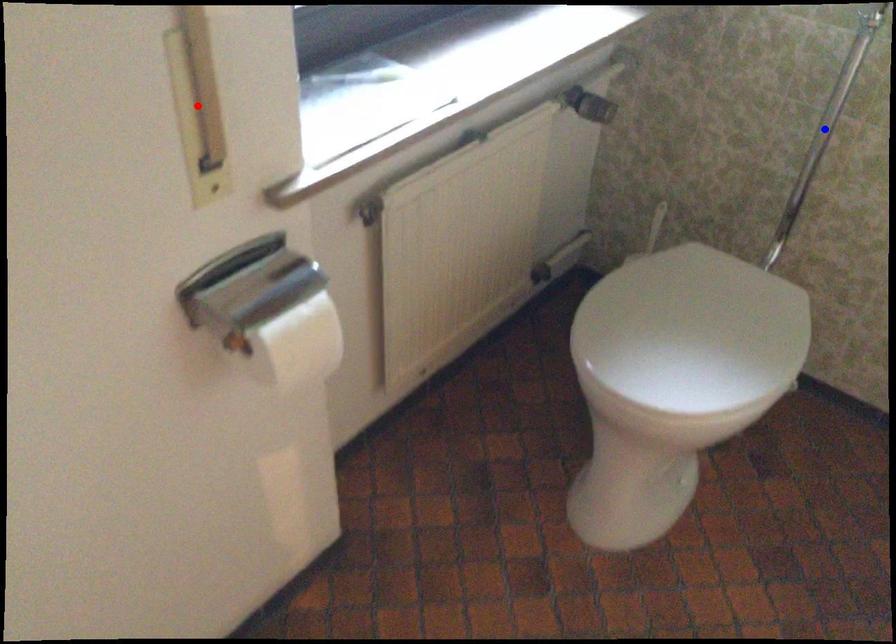
Question: Two points are marked on the image. Which point is closer to the camera?

Choices:
 (A) Blue point is closer.
 (B) Red point is closer.

Answer: (B)